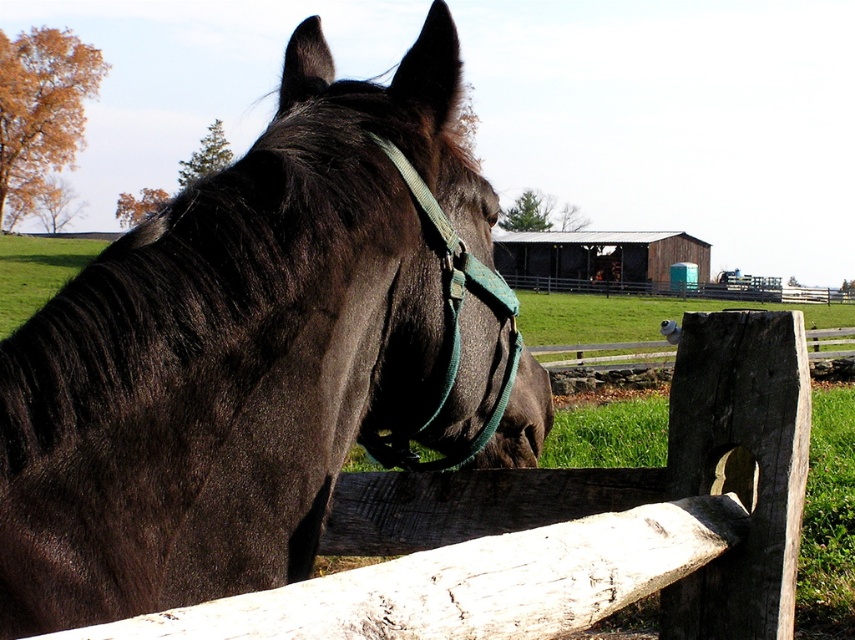
Question: Which point is closer to the camera?

Choices:
 (A) (458, 291)
 (B) (249, 522)

Answer: (B)

Question: Which point is closer to the camera?

Choices:
 (A) (461, 269)
 (B) (240, 408)

Answer: (B)

Question: Is shiny black horse at center positioned behind green fabric bridle at center?

Choices:
 (A) yes
 (B) no

Answer: (B)

Question: Does shiny black horse at center have a larger size compared to green fabric bridle at center?

Choices:
 (A) no
 (B) yes

Answer: (B)

Question: Which of the following is the farthest from the observer?

Choices:
 (A) (358, 435)
 (B) (446, 208)

Answer: (A)

Question: Does shiny black horse at center appear under green fabric bridle at center?

Choices:
 (A) yes
 (B) no

Answer: (A)